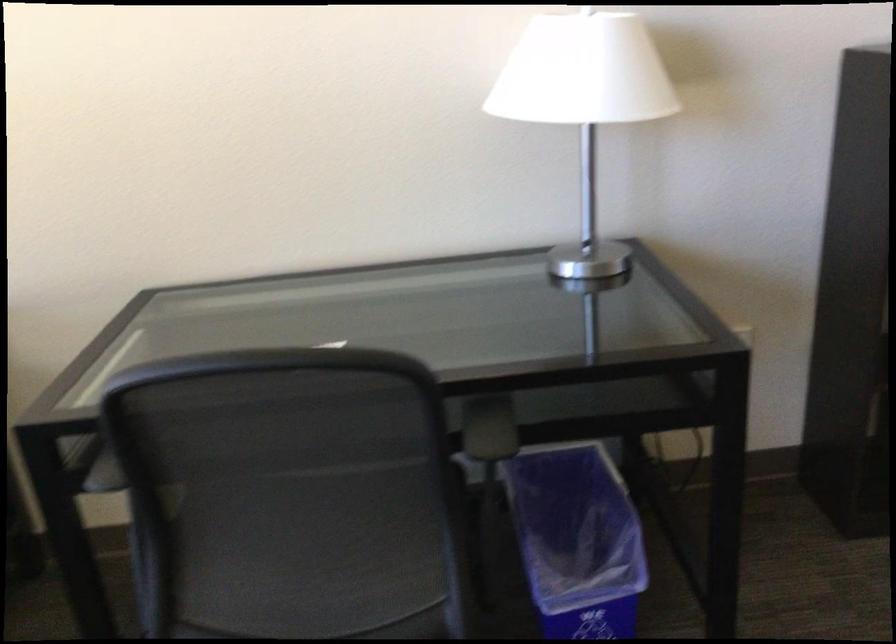
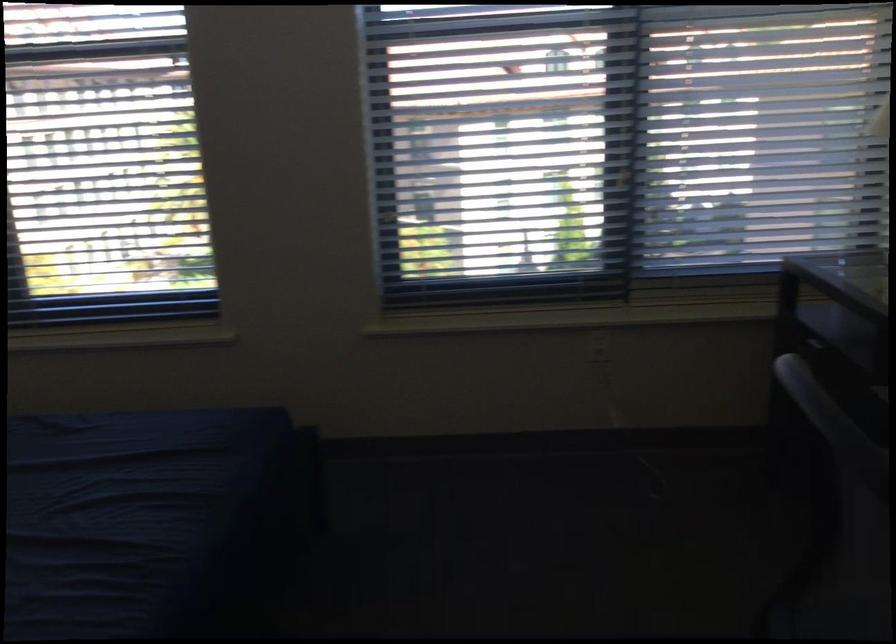
Based on the continuous images, in which direction is the camera rotating?

The rotation direction of the camera is left-down.